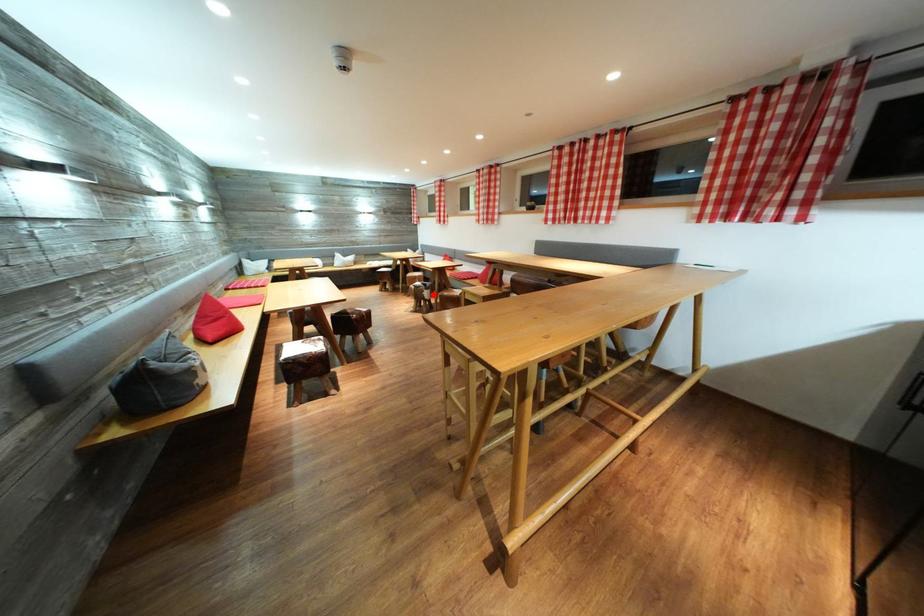
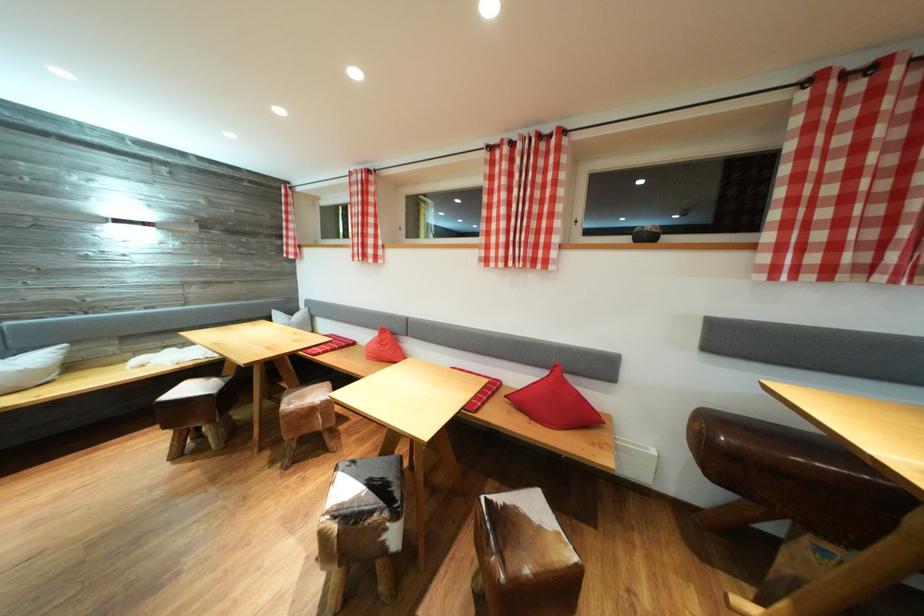
The point at the highlighted location is marked in the first image. Where is the corresponding point in the second image?

(403, 522)